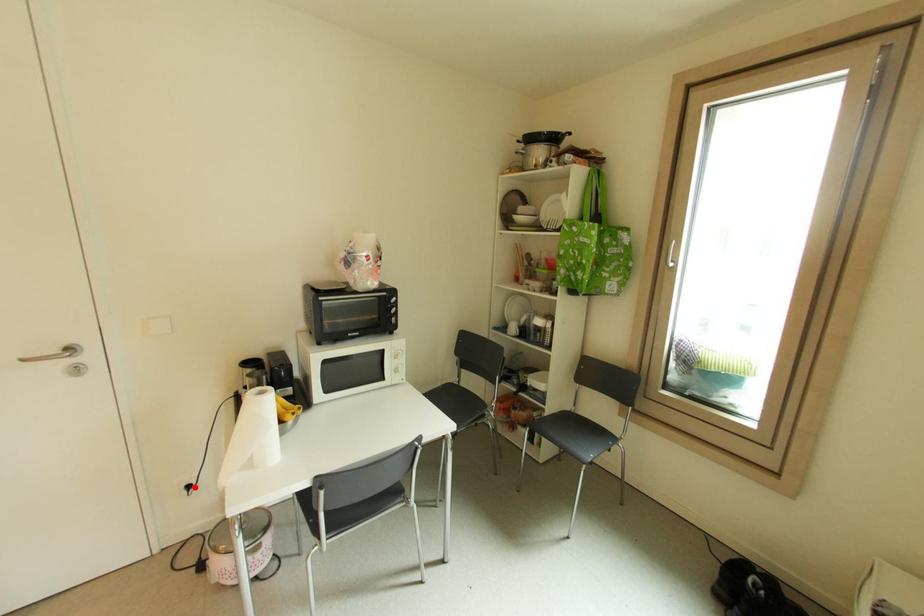
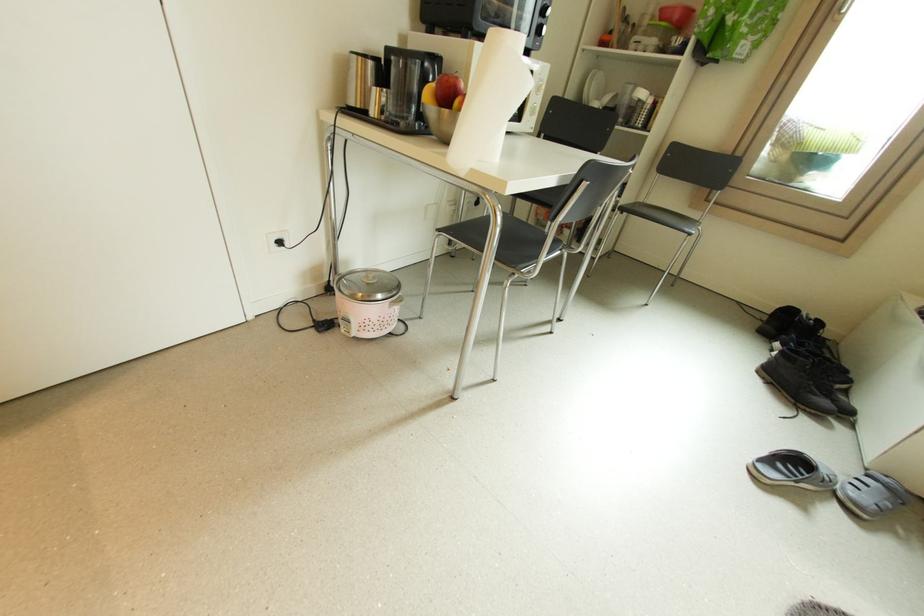
Where in the second image is the point corresponding to the highlighted location from the first image?

(286, 243)